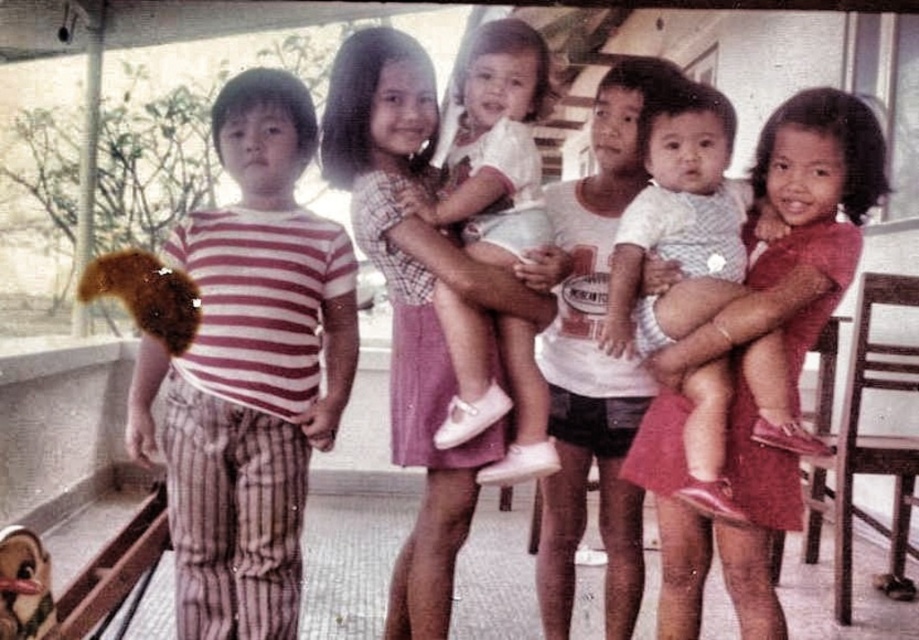
Question: Which point is farther to the camera?

Choices:
 (A) striped fabric shirt at left
 (B) white cotton shirt at center
 (C) white matte dress at center

Answer: (B)

Question: Is the position of striped fabric shirt at left more distant than that of white matte dress at center?

Choices:
 (A) no
 (B) yes

Answer: (A)

Question: Can you confirm if striped fabric shirt at left is positioned above white matte dress at center?

Choices:
 (A) yes
 (B) no

Answer: (B)

Question: Which point is closer to the camera?

Choices:
 (A) (550, 340)
 (B) (418, 204)

Answer: (B)

Question: Does white cotton shirt at center have a smaller size compared to white matte dress at center?

Choices:
 (A) no
 (B) yes

Answer: (A)

Question: Among these objects, which one is nearest to the camera?

Choices:
 (A) white cotton shirt at center
 (B) white matte dress at center
 (C) striped fabric shirt at left

Answer: (C)